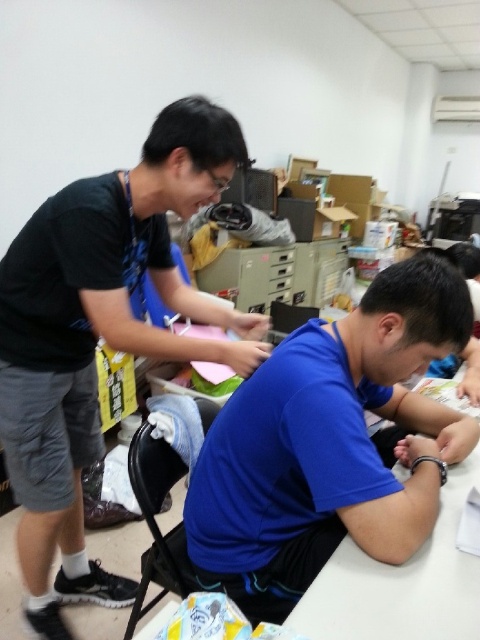
Question: Which object is the farthest from the black matte shirt at left?

Choices:
 (A) white glossy table at lower center
 (B) blue matte shirt at center

Answer: (A)

Question: Is blue matte shirt at center below black matte shirt at left?

Choices:
 (A) yes
 (B) no

Answer: (A)

Question: Estimate the real-world distances between objects in this image. Which object is farther from the black matte shirt at left?

Choices:
 (A) white glossy table at lower center
 (B) blue matte shirt at center

Answer: (A)

Question: Does black matte shirt at left appear on the left side of white glossy table at lower center?

Choices:
 (A) no
 (B) yes

Answer: (B)

Question: Which of the following is the farthest from the observer?

Choices:
 (A) blue matte shirt at center
 (B) white glossy table at lower center
 (C) black matte shirt at left

Answer: (C)

Question: Can you confirm if blue matte shirt at center is thinner than white glossy table at lower center?

Choices:
 (A) no
 (B) yes

Answer: (A)